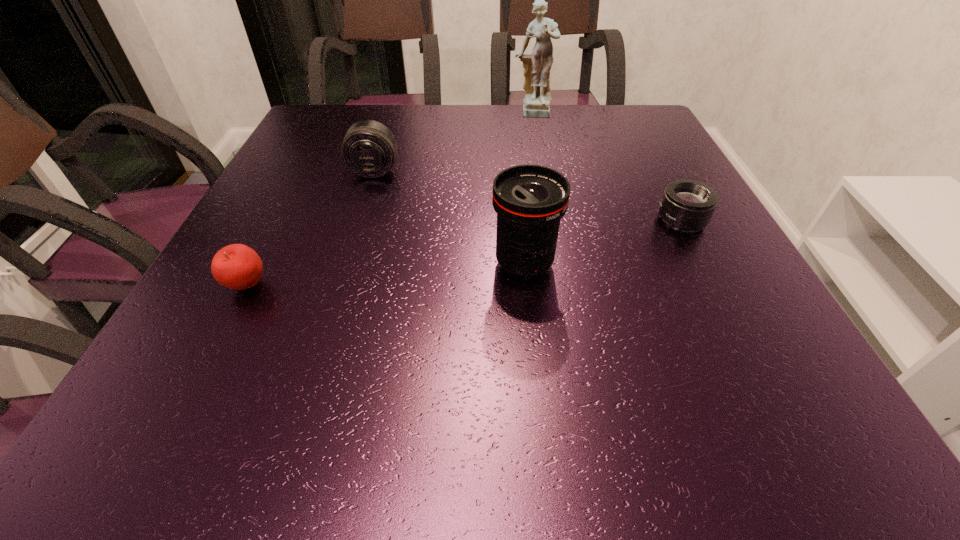
Locate an element on the screen. free region at the far edge is located at coordinates (555, 141).

In the image, there is a desktop. Identify the location of blank space at the near edge. This screenshot has height=540, width=960. (536, 430).

In order to click on free region at the left edge in this screenshot , I will do `click(185, 323)`.

You are a GUI agent. You are given a task and a screenshot of the screen. Output one action in this format:
    pyautogui.click(x=<x>, y=<y>)
    Task: Click on the vacant space at the right edge of the desktop
    This screenshot has height=540, width=960.
    Given the screenshot: What is the action you would take?
    pyautogui.click(x=700, y=377)

In the image, there is a desktop. At what (x,y) coordinates should I click in order to perform the action: click on vacant space at the near right corner. Please return your answer as a coordinate pair (x, y). The image size is (960, 540). Looking at the image, I should click on (813, 418).

You are a GUI agent. You are given a task and a screenshot of the screen. Output one action in this format:
    pyautogui.click(x=<x>, y=<y>)
    Task: Click on the vacant space in between the third nearest object and the farthest object
    The image size is (960, 540).
    Given the screenshot: What is the action you would take?
    pyautogui.click(x=607, y=167)

Locate an element on the screen. free point between the nearest telephoto lens and the shortest object is located at coordinates (603, 242).

The height and width of the screenshot is (540, 960). In order to click on free space between the farthest telephoto lens and the second telephoto lens from right to left in this screenshot , I will do `click(449, 217)`.

Locate an element on the screen. This screenshot has width=960, height=540. unoccupied position between the second telephoto lens from left to right and the fourth tallest object is located at coordinates (386, 275).

I want to click on vacant point located between the nearest telephoto lens and the third farthest object, so click(x=603, y=242).